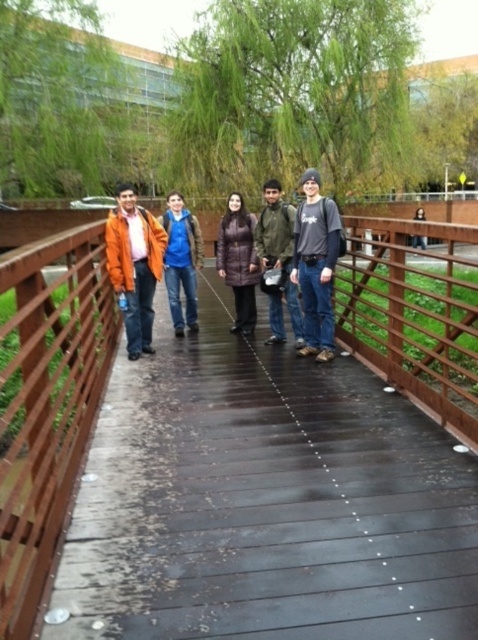
You are a photographer standing on the brown wooden bridge at center and want to take a photo of the blue denim jeans at center. Which object should you focus on first to ensure both are in the frame?

The brown wooden bridge at center is closer to the viewer than the blue denim jeans at center, so you should focus on the blue denim jeans at center first to ensure both are in the frame.

You are standing on the wooden bridge and want to take a photo of both point (329, 605) and point (171, 268). Which point should you focus on first to ensure both are in sharp focus?

You should focus on point (329, 605) first because it is closer to the camera than point (171, 268), ensuring both points are within the depth of field.

You are standing at the origin point in the image. The brown wooden bridge at center is located at coordinates given. If you want to walk towards the bridge, in which direction should you move relative to the image?

Since the brown wooden bridge at center is located at coordinates approximately 0.784 on the x axis and 0.556 on the y axis, you should move towards the right and slightly upwards relative to the image to reach it.